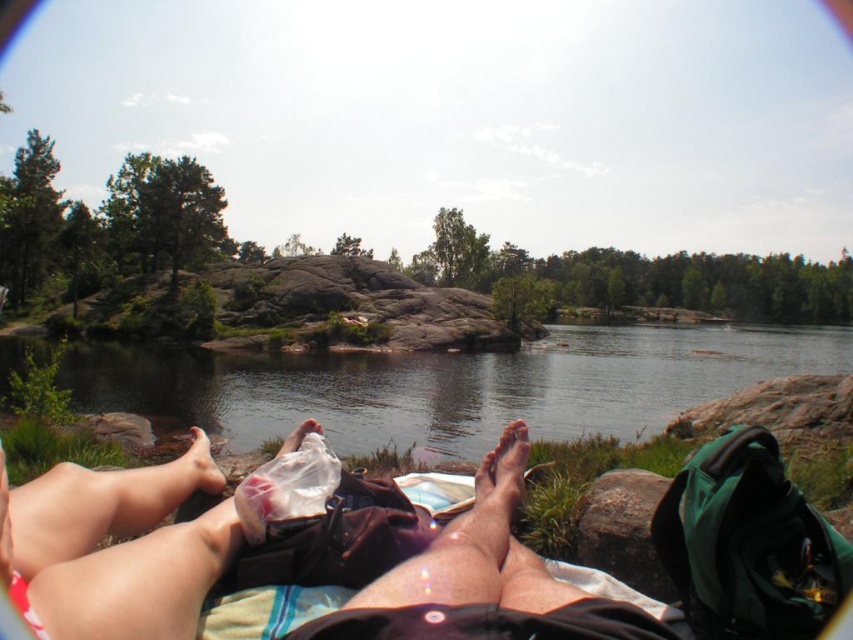
Does clear water at center appear on the right side of rough textured rock at lower right?

Indeed, clear water at center is positioned on the right side of rough textured rock at lower right.

Is clear water at center closer to the viewer compared to rough textured rock at lower right?

No, clear water at center is behind rough textured rock at lower right.

The width and height of the screenshot is (853, 640). What do you see at coordinates (453, 385) in the screenshot?
I see `clear water at center` at bounding box center [453, 385].

This screenshot has height=640, width=853. In order to click on clear water at center in this screenshot , I will do `click(453, 385)`.

Which is more to the left, skinny legs at lower center or dry skin at center?

From the viewer's perspective, skinny legs at lower center appears more on the left side.

Where is `skinny legs at lower center`? The image size is (853, 640). skinny legs at lower center is located at coordinates coord(112,552).

Describe the element at coordinates (112, 552) in the screenshot. This screenshot has width=853, height=640. I see `skinny legs at lower center` at that location.

Is the position of skinny legs at lower center less distant than that of white matte plastic bag at lower center?

Yes.

Locate an element on the screen. Image resolution: width=853 pixels, height=640 pixels. skinny legs at lower center is located at coordinates (112, 552).

This screenshot has height=640, width=853. Identify the location of skinny legs at lower center. (112, 552).